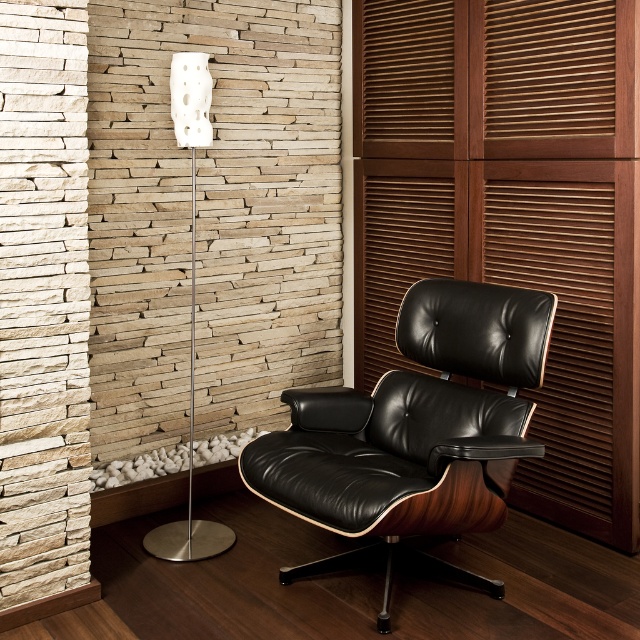
You are an interior designer assessing the spatial arrangement of the room. You need to determine if the wooden slats at right and the white matte floor lamp at left can be placed side by side without overlapping. Given their widths, will they fit together in the available space?

The wooden slats at right are wider than the white matte floor lamp at left. Since their combined width would require sufficient space, but the exact available space isn

You are an interior designer assessing the room layout. You need to determine which object is taller between the wooden slats at right and the white matte floor lamp at left. Based on the scene, which one is taller?

The wooden slats at right has a greater height compared to the white matte floor lamp at left, so the wooden slats at right is taller.

You are an interior designer assessing the layout of the room. You notice the wooden slats at right and the white matte floor lamp at left. Which object is closer to the viewer?

The wooden slats at right is closer to the viewer because it is in front of the white matte floor lamp at left.